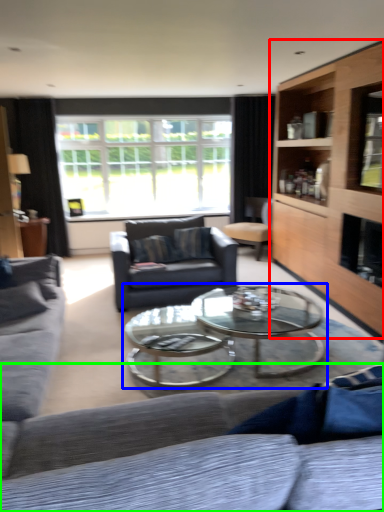
Question: Which object is positioned closest to cabinetry (highlighted by a red box)? Select from coffee table (highlighted by a blue box) and studio couch (highlighted by a green box).

Choices:
 (A) coffee table
 (B) studio couch

Answer: (A)